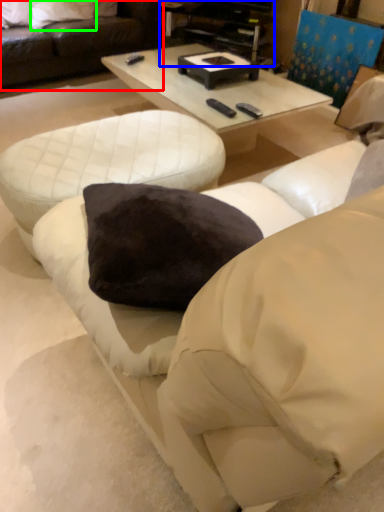
Question: Based on their relative distances, which object is farther from studio couch (highlighted by a red box)? Choose from entertainment center (highlighted by a blue box) and pillow (highlighted by a green box).

Choices:
 (A) entertainment center
 (B) pillow

Answer: (A)